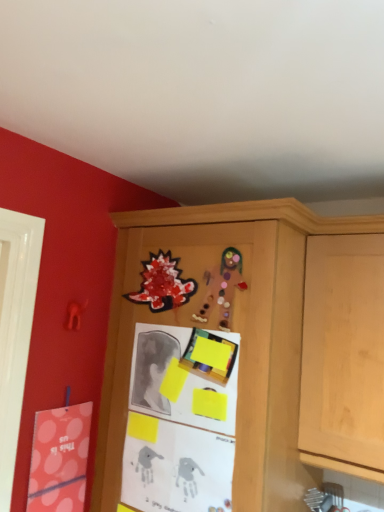
Question: Which direction should I rotate to look at glittery paper dinosaur at upper center, which ranks as the 2th art in right-to-left order?

Choices:
 (A) left
 (B) right

Answer: (A)

Question: From the image's perspective, is yellow paper at center on top of wooden cabinet at center?

Choices:
 (A) yes
 (B) no

Answer: (A)

Question: From a real-world perspective, is yellow paper at center below wooden cabinet at center?

Choices:
 (A) yes
 (B) no

Answer: (B)

Question: From the image's perspective, is yellow paper at center beneath wooden cabinet at center?

Choices:
 (A) no
 (B) yes

Answer: (A)

Question: Is yellow paper at center bigger than wooden cabinet at center?

Choices:
 (A) yes
 (B) no

Answer: (B)

Question: Is yellow paper at center positioned in front of wooden cabinet at center?

Choices:
 (A) yes
 (B) no

Answer: (B)

Question: Is yellow paper at center taller than wooden cabinet at center?

Choices:
 (A) no
 (B) yes

Answer: (A)

Question: Does glittery paper dinosaur at upper center, which ranks as the 2th art in right-to-left order, have a lesser width compared to matte pink postcard at left?

Choices:
 (A) no
 (B) yes

Answer: (B)

Question: Is glittery paper dinosaur at upper center, which ranks as the second art in front-to-back order, taller than matte pink postcard at left?

Choices:
 (A) yes
 (B) no

Answer: (B)

Question: Does glittery paper dinosaur at upper center, acting as the 1th art starting from the back, come in front of matte pink postcard at left?

Choices:
 (A) no
 (B) yes

Answer: (A)

Question: Could you tell me if glittery paper dinosaur at upper center, acting as the 1th art starting from the back, is turned towards matte pink postcard at left?

Choices:
 (A) no
 (B) yes

Answer: (A)

Question: Is glittery paper dinosaur at upper center, which ranks as the 2th art in right-to-left order, smaller than matte pink postcard at left?

Choices:
 (A) no
 (B) yes

Answer: (B)

Question: From the image's perspective, is glittery paper dinosaur at upper center, acting as the 1th art starting from the back, under matte pink postcard at left?

Choices:
 (A) no
 (B) yes

Answer: (A)

Question: Considering the relative sizes of wooden cabinet at center and glittery paper dinosaur at upper center, which is counted as the 1th art, starting from the left, in the image provided, is wooden cabinet at center taller than glittery paper dinosaur at upper center, which is counted as the 1th art, starting from the left,?

Choices:
 (A) no
 (B) yes

Answer: (B)